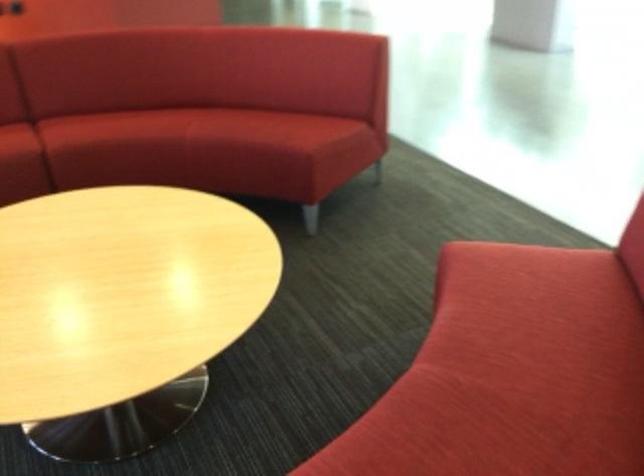
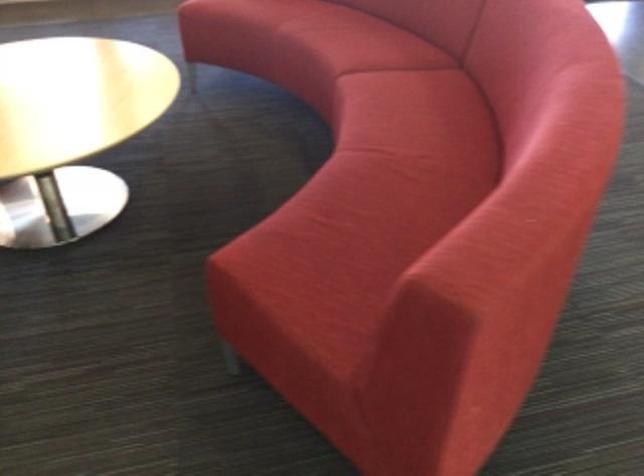
Locate, in the second image, the point that corresponds to (167,119) in the first image.

(422, 135)